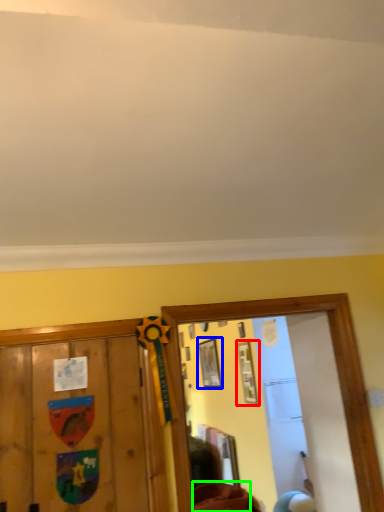
Question: Which object is positioned farthest from picture frame (highlighted by a red box)? Select from picture frame (highlighted by a blue box) and furniture (highlighted by a green box).

Choices:
 (A) picture frame
 (B) furniture

Answer: (B)